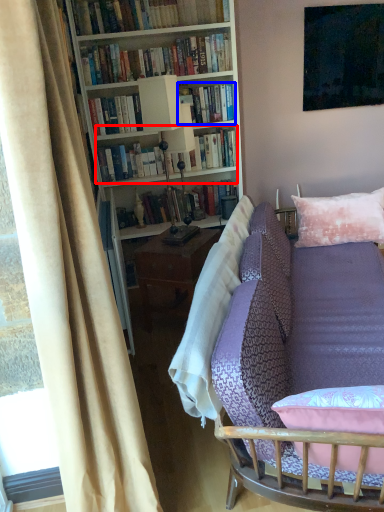
Question: Which point is closer to the camera, book (highlighted by a red box) or book (highlighted by a blue box)?

Choices:
 (A) book
 (B) book

Answer: (B)